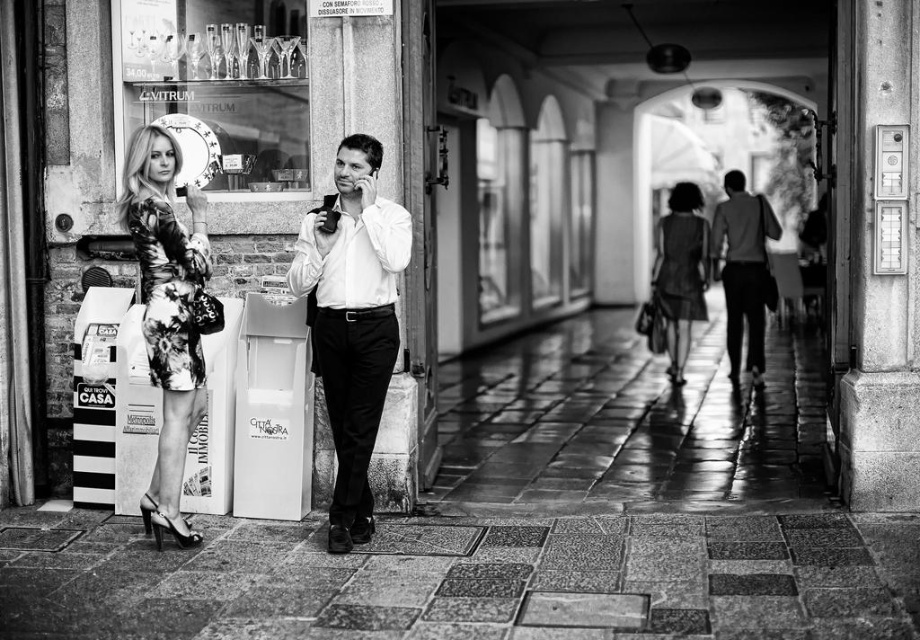
Is point (834, 538) behind point (705, 272)?

No, it is in front of (705, 272).

Between point (290, 625) and point (704, 307), which one is positioned behind?

Positioned behind is point (704, 307).

Identify the location of granite tiles at center. Image resolution: width=920 pixels, height=640 pixels. (467, 579).

Identify the location of granite tiles at center. This screenshot has width=920, height=640. (467, 579).

Is polished stone pavement at center bigger than silky black dress at center?

Incorrect, polished stone pavement at center is not larger than silky black dress at center.

What do you see at coordinates (628, 422) in the screenshot? The image size is (920, 640). I see `polished stone pavement at center` at bounding box center [628, 422].

Measure the distance between point (515,460) and camera.

They are 26.93 feet apart.

The image size is (920, 640). Find the location of `polished stone pavement at center`. polished stone pavement at center is located at coordinates (628, 422).

Between polished stone pavement at center and smooth white shirt at center, which one is positioned higher?

Positioned higher is smooth white shirt at center.

Who is shorter, polished stone pavement at center or smooth white shirt at center?

polished stone pavement at center

The height and width of the screenshot is (640, 920). In order to click on polished stone pavement at center in this screenshot , I will do tap(628, 422).